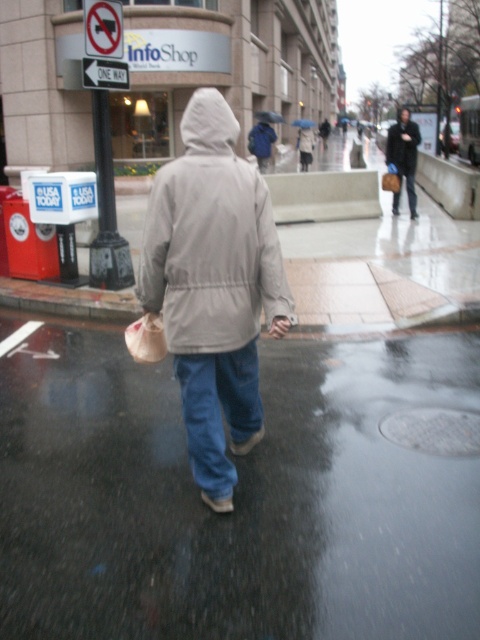
Question: Does dark brown leather jacket at upper right lie in front of black matte umbrella at upper center?

Choices:
 (A) yes
 (B) no

Answer: (A)

Question: Considering the relative positions of light gray matte jacket at center and dark brown leather jacket at upper right in the image provided, where is light gray matte jacket at center located with respect to dark brown leather jacket at upper right?

Choices:
 (A) above
 (B) below

Answer: (B)

Question: Which of the following is the farthest from the observer?

Choices:
 (A) dark gray textured jacket at upper right
 (B) blue denim jeans at lower right
 (C) blue backpack at center
 (D) black matte umbrella at upper center

Answer: (D)

Question: Which object is the closest to the blue fabric umbrella at center?

Choices:
 (A) light gray matte jacket at center
 (B) blue denim jeans at lower right
 (C) dark gray textured jacket at upper right
 (D) denim jeans at lower center

Answer: (B)

Question: Does blue denim jeans at lower right appear under black matte umbrella at upper center?

Choices:
 (A) no
 (B) yes

Answer: (B)

Question: Considering the real-world distances, which object is closest to the blue fabric umbrella at center?

Choices:
 (A) blue backpack at center
 (B) matte gray coat at center

Answer: (B)